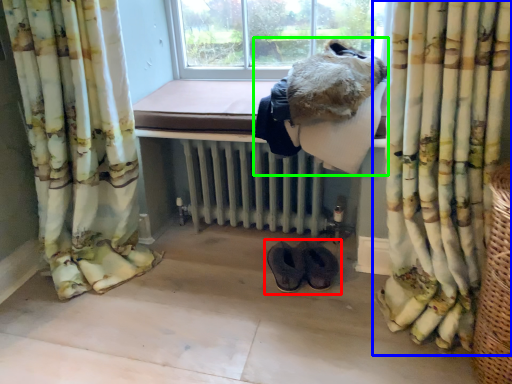
Question: Considering the real-world distances, which object is closest to footwear (highlighted by a red box)? curtain (highlighted by a blue box) or animal (highlighted by a green box).

Choices:
 (A) curtain
 (B) animal

Answer: (A)